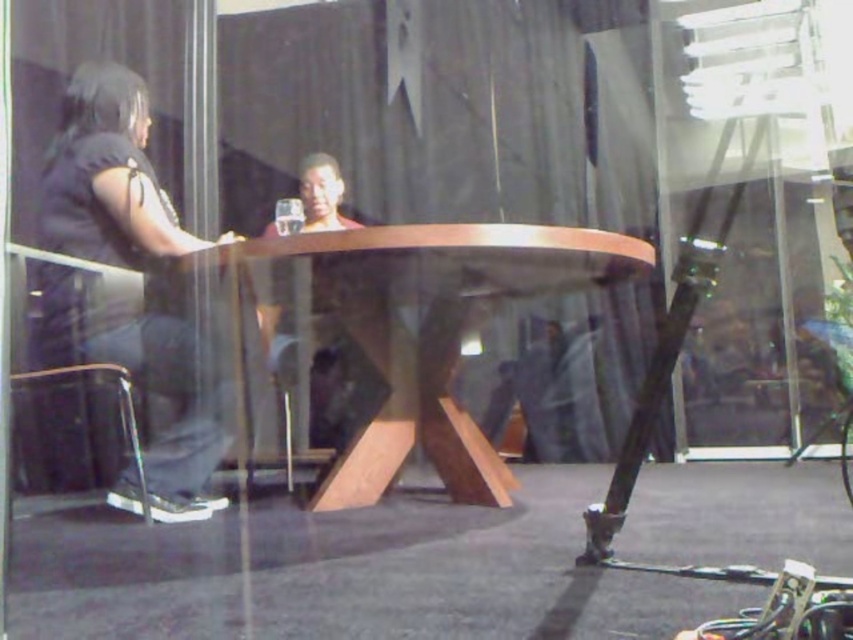
From the picture: You are standing outside looking through the glass window at the scene. You notice the wooden at center and the black fabric shirt at left. Which object would appear bigger in the reflection on the glass?

The wooden at center is larger in size than the black fabric shirt at left, so it would appear bigger in the reflection on the glass.